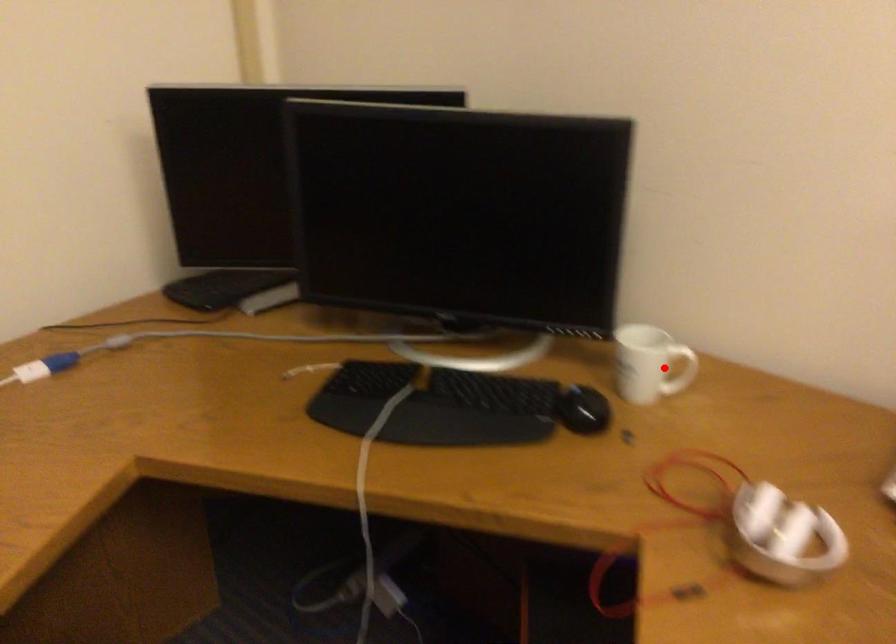
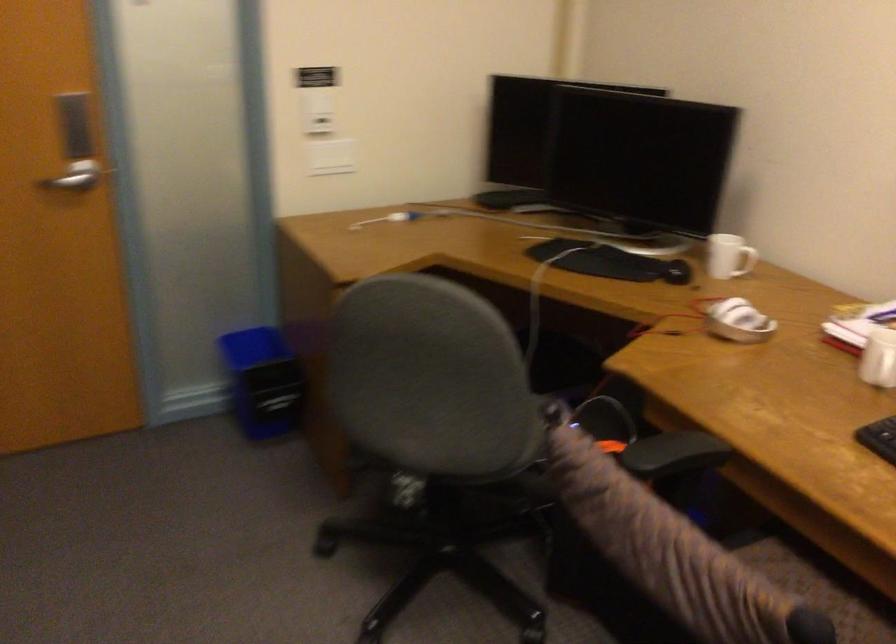
Question: A red point is marked in image1. In image2, is the corresponding 3D point closer to the camera or farther? Reply with the corresponding letter.

Choices:
 (A) The corresponding 3D point is closer.
 (B) The corresponding 3D point is farther.

Answer: (B)